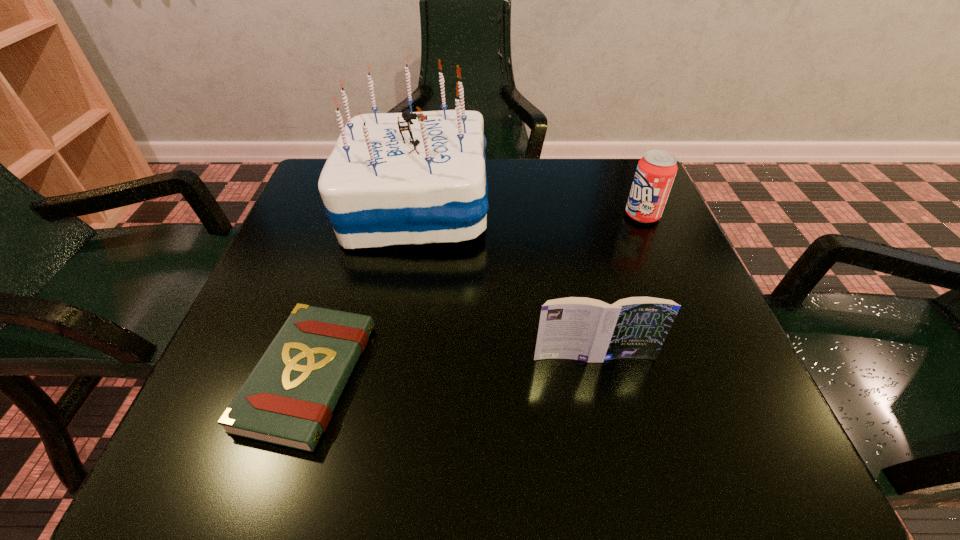
This screenshot has height=540, width=960. Identify the location of free space that satisfies the following two spatial constraints: 1. on the surface of the rightmost object; 2. on the front cover of the taller book. (703, 357).